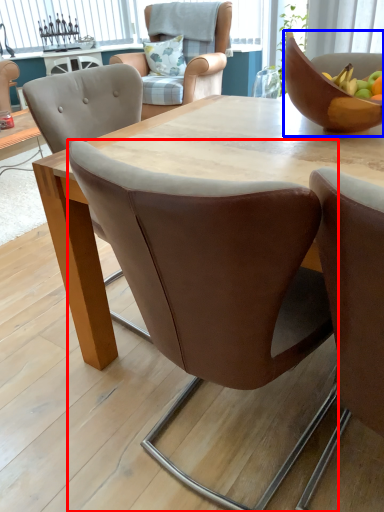
Question: Which object appears closest to the camera in this image, chair (highlighted by a red box) or bowl (highlighted by a blue box)?

Choices:
 (A) chair
 (B) bowl

Answer: (A)